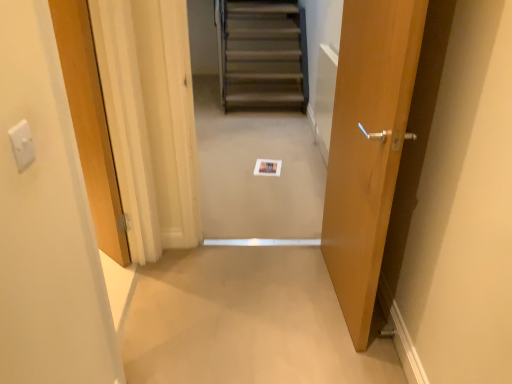
Locate an element on the screen. The width and height of the screenshot is (512, 384). wooden door at center, which ranks as the first door in left-to-right order is located at coordinates (46, 222).

The height and width of the screenshot is (384, 512). Identify the location of wooden stairs at center. (253, 168).

Find the location of `white plastic electric outlet at upper left`. white plastic electric outlet at upper left is located at coordinates (22, 145).

Describe the element at coordinates (367, 147) in the screenshot. I see `matte wood door at right, the 1th door in the right-to-left sequence` at that location.

Find the location of `wooden door at center, marked as the 2th door in a right-to-left arrangement`. wooden door at center, marked as the 2th door in a right-to-left arrangement is located at coordinates (46, 222).

Visually, is wooden door at center, which ranks as the first door in left-to-right order, positioned to the left or to the right of white plastic electric outlet at upper left?

From the image, it's evident that wooden door at center, which ranks as the first door in left-to-right order, is to the left of white plastic electric outlet at upper left.

Would you say wooden door at center, marked as the 2th door in a right-to-left arrangement, contains white plastic electric outlet at upper left?

Actually, white plastic electric outlet at upper left is outside wooden door at center, marked as the 2th door in a right-to-left arrangement.

Which is nearer, (82,359) or (23,169)?

The point (23,169) is closer to the camera.

Between wooden door at center, marked as the 2th door in a right-to-left arrangement, and white plastic electric outlet at upper left, which one has larger size?

wooden door at center, marked as the 2th door in a right-to-left arrangement.

Does white plastic electric outlet at upper left have a greater height compared to matte wood door at right, which is the 2th door in left-to-right order?

In fact, white plastic electric outlet at upper left may be shorter than matte wood door at right, which is the 2th door in left-to-right order.

Considering the sizes of white plastic electric outlet at upper left and matte wood door at right, which is the 2th door in left-to-right order, in the image, is white plastic electric outlet at upper left bigger or smaller than matte wood door at right, which is the 2th door in left-to-right order,?

Clearly, white plastic electric outlet at upper left is smaller in size than matte wood door at right, which is the 2th door in left-to-right order.

In the scene shown: Considering the relative positions of white plastic electric outlet at upper left and matte wood door at right, which is the 2th door in left-to-right order, in the image provided, is white plastic electric outlet at upper left to the right of matte wood door at right, which is the 2th door in left-to-right order, from the viewer's perspective?

In fact, white plastic electric outlet at upper left is to the left of matte wood door at right, which is the 2th door in left-to-right order.

Is point (20, 141) closer or farther from the camera than point (336, 80)?

Point (20, 141).

From the image's perspective, is wooden stairs at center below beige carpet at center?

Incorrect, from the image's perspective, wooden stairs at center is higher than beige carpet at center.

Considering the relative sizes of wooden stairs at center and beige carpet at center in the image provided, is wooden stairs at center bigger than beige carpet at center?

Yes.

From their relative heights in the image, would you say wooden stairs at center is taller or shorter than beige carpet at center?

Considering their sizes, wooden stairs at center has more height than beige carpet at center.

Which point is more forward, [295,169] or [318,379]?

Positioned in front is point [318,379].

From the image's perspective, is beige carpet at center below matte wood door at right, the 1th door in the right-to-left sequence?

Yes.

Considering the sizes of objects beige carpet at center and matte wood door at right, which is the 2th door in left-to-right order, in the image provided, who is taller, beige carpet at center or matte wood door at right, which is the 2th door in left-to-right order,?

matte wood door at right, which is the 2th door in left-to-right order.

Which is less distant, [149,264] or [326,243]?

Point [149,264] is positioned farther from the camera compared to point [326,243].

From the image's perspective, is matte wood door at right, the 1th door in the right-to-left sequence, located above or below wooden stairs at center?

Based on their image positions, matte wood door at right, the 1th door in the right-to-left sequence, is located beneath wooden stairs at center.

Between matte wood door at right, the 1th door in the right-to-left sequence, and wooden stairs at center, which one has smaller size?

wooden stairs at center is smaller.

In terms of height, does matte wood door at right, which is the 2th door in left-to-right order, look taller or shorter compared to wooden stairs at center?

In the image, matte wood door at right, which is the 2th door in left-to-right order, appears to be taller than wooden stairs at center.

Does point (291, 224) come farther from viewer compared to point (32, 144)?

Yes, it is behind point (32, 144).

Where is `escalator on the right side of white plastic electric outlet at upper left`? escalator on the right side of white plastic electric outlet at upper left is located at coordinates (253, 168).

From a real-world perspective, who is located higher, wooden stairs at center or white plastic electric outlet at upper left?

In real-world perspective, white plastic electric outlet at upper left is above.

Which object is further away from the camera, matte wood door at right, the 1th door in the right-to-left sequence, or wooden door at center, which ranks as the first door in left-to-right order?

matte wood door at right, the 1th door in the right-to-left sequence, is behind.

Is matte wood door at right, which is the 2th door in left-to-right order, looking in the opposite direction of wooden door at center, marked as the 2th door in a right-to-left arrangement?

No.

This screenshot has height=384, width=512. In order to click on the 1st door behind the white plastic electric outlet at upper left in this screenshot , I will do `click(46, 222)`.

From a real-world perspective, which door is the 1st one underneath the white plastic electric outlet at upper left? Please provide its 2D coordinates.

[(367, 147)]

Estimate the real-world distances between objects in this image. Which object is further from wooden door at center, marked as the 2th door in a right-to-left arrangement, matte wood door at right, which is the 2th door in left-to-right order, or beige carpet at center?

The object further to wooden door at center, marked as the 2th door in a right-to-left arrangement, is matte wood door at right, which is the 2th door in left-to-right order.

Which object lies further to the anchor point matte wood door at right, which is the 2th door in left-to-right order, wooden stairs at center or wooden door at center, which ranks as the first door in left-to-right order?

wooden stairs at center.

Based on their spatial positions, is white plastic electric outlet at upper left or beige carpet at center further from matte wood door at right, the 1th door in the right-to-left sequence?

Based on the image, white plastic electric outlet at upper left appears to be further to matte wood door at right, the 1th door in the right-to-left sequence.

When comparing their distances from matte wood door at right, which is the 2th door in left-to-right order, does beige carpet at center or wooden door at center, marked as the 2th door in a right-to-left arrangement, seem further?

wooden door at center, marked as the 2th door in a right-to-left arrangement, is positioned further to the anchor matte wood door at right, which is the 2th door in left-to-right order.

Estimate the real-world distances between objects in this image. Which object is further from matte wood door at right, which is the 2th door in left-to-right order, wooden stairs at center or beige carpet at center?

wooden stairs at center is positioned further to the anchor matte wood door at right, which is the 2th door in left-to-right order.

Which object lies further to the anchor point beige carpet at center, matte wood door at right, which is the 2th door in left-to-right order, or wooden stairs at center?

Among the two, wooden stairs at center is located further to beige carpet at center.

Estimate the real-world distances between objects in this image. Which object is further from matte wood door at right, the 1th door in the right-to-left sequence, wooden door at center, marked as the 2th door in a right-to-left arrangement, or white plastic electric outlet at upper left?

white plastic electric outlet at upper left is positioned further to the anchor matte wood door at right, the 1th door in the right-to-left sequence.

Estimate the real-world distances between objects in this image. Which object is closer to wooden door at center, which ranks as the first door in left-to-right order, wooden stairs at center or white plastic electric outlet at upper left?

white plastic electric outlet at upper left.

The width and height of the screenshot is (512, 384). I want to click on electric outlet between wooden door at center, which ranks as the first door in left-to-right order, and matte wood door at right, the 1th door in the right-to-left sequence, in the horizontal direction, so click(x=22, y=145).

You are a GUI agent. You are given a task and a screenshot of the screen. Output one action in this format:
    pyautogui.click(x=<x>, y=<y>)
    Task: Click on the plain located between white plastic electric outlet at upper left and matte wood door at right, which is the 2th door in left-to-right order, in the left-right direction
    The height and width of the screenshot is (384, 512).
    Given the screenshot: What is the action you would take?
    pyautogui.click(x=245, y=321)

Find the location of a particular element. plain between wooden door at center, which ranks as the first door in left-to-right order, and matte wood door at right, which is the 2th door in left-to-right order is located at coordinates (245, 321).

Find the location of a particular element. plain located between wooden door at center, marked as the 2th door in a right-to-left arrangement, and wooden stairs at center in the depth direction is located at coordinates (245, 321).